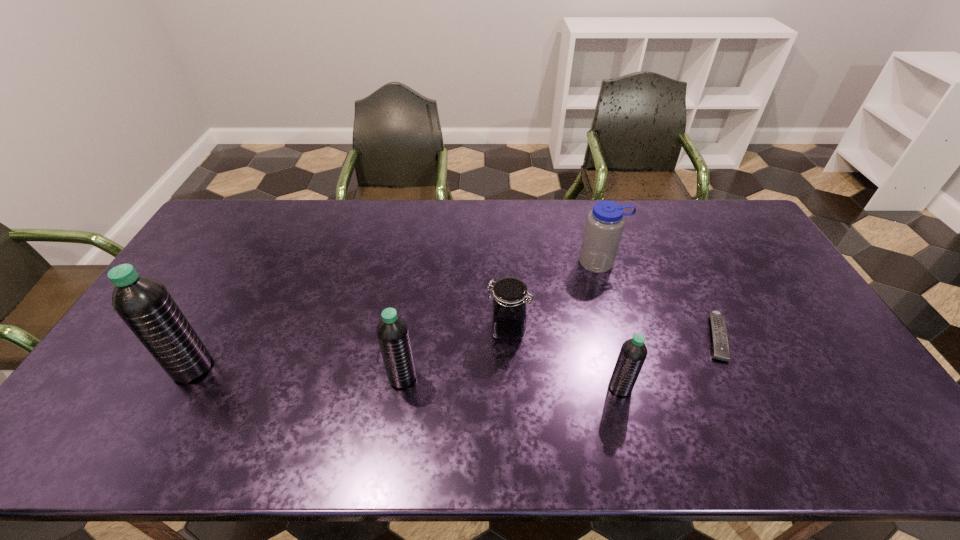
Please point a spot to add another water bottle on the right. Please provide its 2D coordinates. Your answer should be formatted as a tuple, i.e. [(x, y)], where the tuple contains the x and y coordinates of a point satisfying the conditions above.

[(847, 397)]